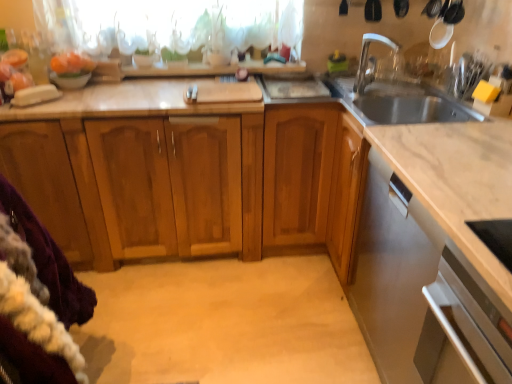
This screenshot has width=512, height=384. I want to click on free point to the right of white glossy bowl at upper left, so click(x=106, y=94).